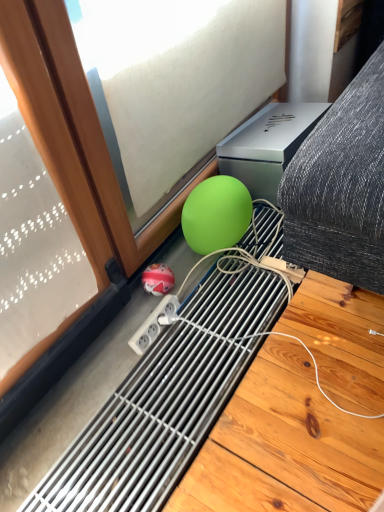
Question: Should I look upward or downward to see green matte ball at lower center, which appears as the 1th ball when viewed from the top?

Choices:
 (A) up
 (B) down

Answer: (A)

Question: Can you see shiny red ball at lower center, the 2th ball from the right, touching green matte sphere at lower center?

Choices:
 (A) no
 (B) yes

Answer: (A)

Question: Is shiny red ball at lower center, which appears as the second ball when viewed from the top, oriented towards green matte sphere at lower center?

Choices:
 (A) yes
 (B) no

Answer: (B)

Question: Is shiny red ball at lower center, which ranks as the 1th ball in bottom-to-top order, at the left side of green matte sphere at lower center?

Choices:
 (A) yes
 (B) no

Answer: (A)

Question: From a real-world perspective, is shiny red ball at lower center, positioned as the 1th ball in left-to-right order, located higher than green matte sphere at lower center?

Choices:
 (A) no
 (B) yes

Answer: (A)

Question: From a real-world perspective, is shiny red ball at lower center, which ranks as the 1th ball in bottom-to-top order, located beneath green matte sphere at lower center?

Choices:
 (A) yes
 (B) no

Answer: (A)

Question: Is shiny red ball at lower center, which ranks as the 1th ball in bottom-to-top order, to the right of green matte sphere at lower center from the viewer's perspective?

Choices:
 (A) yes
 (B) no

Answer: (B)

Question: From the image's perspective, does green matte ball at lower center, placed as the 1th ball when sorted from right to left, appear higher than green matte sphere at lower center?

Choices:
 (A) no
 (B) yes

Answer: (A)

Question: Is green matte ball at lower center, which is counted as the 2th ball, starting from the bottom, closer to camera compared to green matte sphere at lower center?

Choices:
 (A) no
 (B) yes

Answer: (A)

Question: From a real-world perspective, is green matte ball at lower center, which appears as the 1th ball when viewed from the top, over green matte sphere at lower center?

Choices:
 (A) no
 (B) yes

Answer: (A)

Question: Is green matte ball at lower center, which appears as the 1th ball when viewed from the top, not near green matte sphere at lower center?

Choices:
 (A) no
 (B) yes

Answer: (A)

Question: Considering the relative sizes of green matte ball at lower center, which is counted as the 2th ball, starting from the bottom, and green matte sphere at lower center in the image provided, is green matte ball at lower center, which is counted as the 2th ball, starting from the bottom, shorter than green matte sphere at lower center?

Choices:
 (A) no
 (B) yes

Answer: (B)

Question: Is green matte ball at lower center, the 2th ball in the left-to-right sequence, to the right of green matte sphere at lower center from the viewer's perspective?

Choices:
 (A) no
 (B) yes

Answer: (B)

Question: Is green matte sphere at lower center wider than green matte ball at lower center, which appears as the 1th ball when viewed from the top?

Choices:
 (A) no
 (B) yes

Answer: (A)